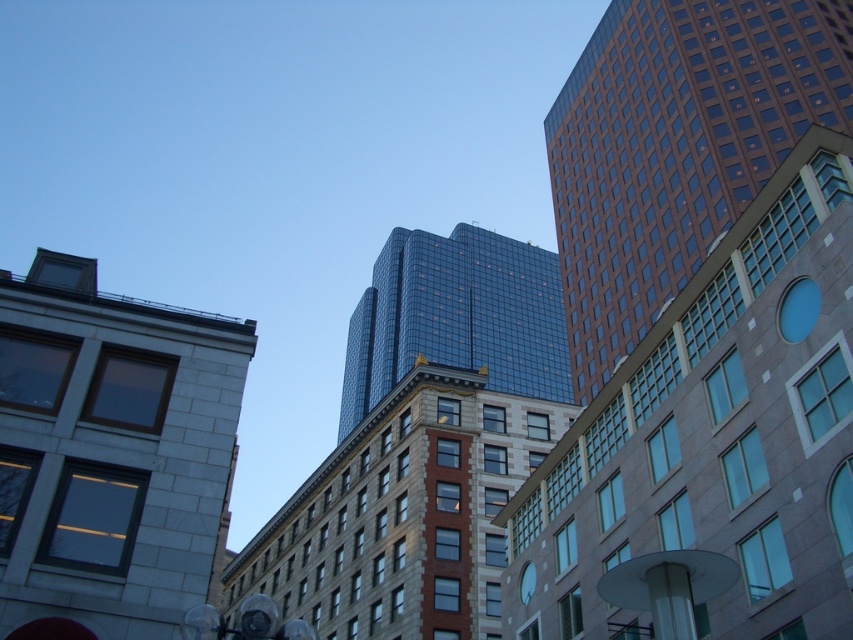
Is point (625, 108) positioned behind point (532, 582)?

Yes, it is.

The image size is (853, 640). In order to click on brown glassy skyscraper at right in this screenshot , I will do `click(676, 147)`.

What do you see at coordinates (676, 147) in the screenshot? I see `brown glassy skyscraper at right` at bounding box center [676, 147].

At what (x,y) coordinates should I click in order to perform the action: click on brown glassy skyscraper at right. Please return your answer as a coordinate pair (x, y). This screenshot has height=640, width=853. Looking at the image, I should click on (676, 147).

Does gray stone building at upper left appear on the right side of brown glassy skyscraper at right?

Incorrect, gray stone building at upper left is not on the right side of brown glassy skyscraper at right.

Does point (192, 330) lie in front of point (584, 52)?

Yes, it is.

The height and width of the screenshot is (640, 853). Find the location of `gray stone building at upper left`. gray stone building at upper left is located at coordinates (111, 454).

Can you confirm if gray stone building at upper left is bigger than blue glass clock at upper center?

Correct, gray stone building at upper left is larger in size than blue glass clock at upper center.

The height and width of the screenshot is (640, 853). Identify the location of gray stone building at upper left. (111, 454).